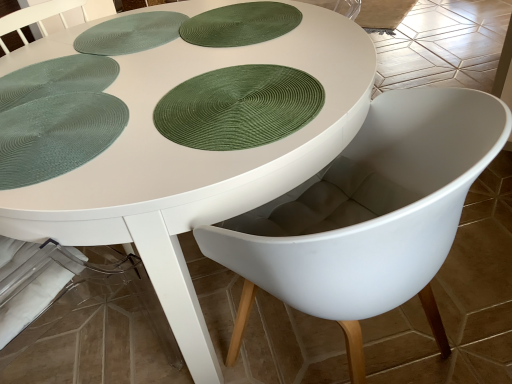
You are a GUI agent. You are given a task and a screenshot of the screen. Output one action in this format:
    pyautogui.click(x=<x>, y=<y>)
    Task: Click on the free space between green textured placemat at upper left and green textured placemat at left, marked as the fourth paper plate in a top-to-bottom arrangement
    The width and height of the screenshot is (512, 384).
    Given the screenshot: What is the action you would take?
    pos(124,73)